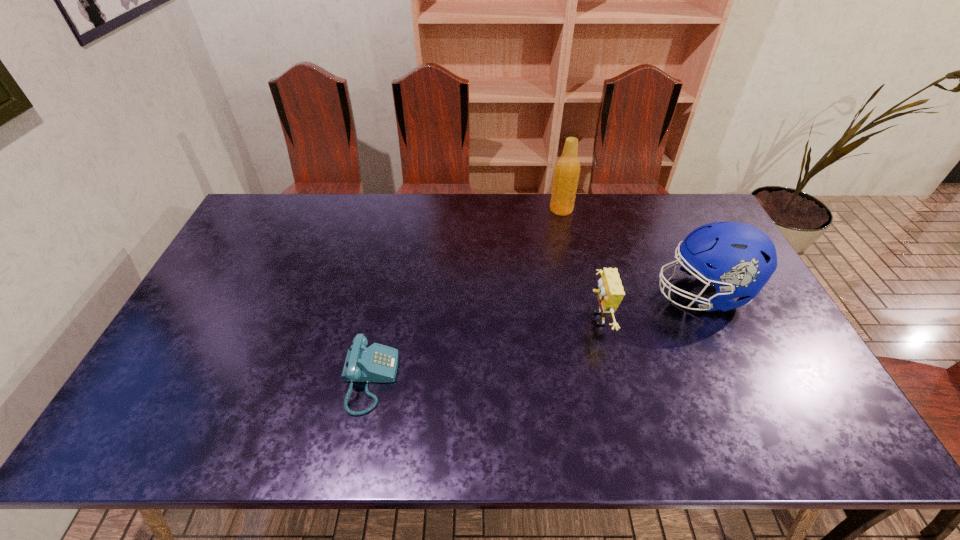
At what (x,y) coordinates should I click in order to perform the action: click on beer bottle. Please return your answer as a coordinate pair (x, y). The height and width of the screenshot is (540, 960). Looking at the image, I should click on (567, 169).

At what (x,y) coordinates should I click in order to perform the action: click on the rightmost object. Please return your answer as a coordinate pair (x, y). The width and height of the screenshot is (960, 540). Looking at the image, I should click on (738, 259).

Locate an element on the screen. This screenshot has width=960, height=540. the second shortest object is located at coordinates (610, 293).

Find the location of `telephone`. telephone is located at coordinates (378, 363).

Locate an element on the screen. This screenshot has width=960, height=540. the leftmost object is located at coordinates (378, 363).

The image size is (960, 540). I want to click on vacant space situated 0.170m on the front of the farthest object, so click(x=570, y=248).

Where is `vacant area situated on the face guard of the football helmet`? vacant area situated on the face guard of the football helmet is located at coordinates (553, 293).

What are the coordinates of `vacant space located on the face guard of the football helmet` in the screenshot? It's located at (530, 293).

Image resolution: width=960 pixels, height=540 pixels. What are the coordinates of `vacant area situated 0.100m on the face guard of the football helmet` in the screenshot? It's located at (620, 293).

Identify the location of vacant area situated 0.390m on the face of the second shortest object. (447, 319).